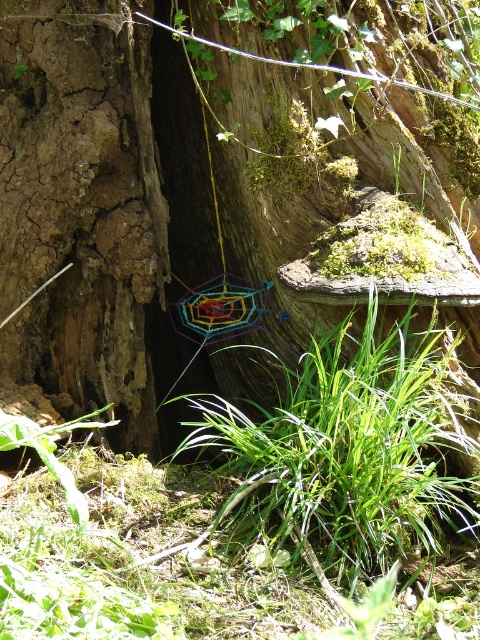
Question: Can you confirm if wooden tree trunk at center is thinner than brown rough tree trunk at left?

Choices:
 (A) no
 (B) yes

Answer: (A)

Question: Based on their relative distances, which object is farther from the wooden tree trunk at center?

Choices:
 (A) brown rough tree trunk at left
 (B) green grass at center

Answer: (B)

Question: Does wooden tree trunk at center have a smaller size compared to green grass at center?

Choices:
 (A) no
 (B) yes

Answer: (A)

Question: Based on their relative distances, which object is farther from the wooden tree trunk at center?

Choices:
 (A) brown rough tree trunk at left
 (B) green grass at center

Answer: (B)

Question: In this image, where is wooden tree trunk at center located relative to green grass at center?

Choices:
 (A) right
 (B) left

Answer: (B)

Question: Which of the following is the farthest from the observer?

Choices:
 (A) wooden tree trunk at center
 (B) green grass at center
 (C) brown rough tree trunk at left

Answer: (C)